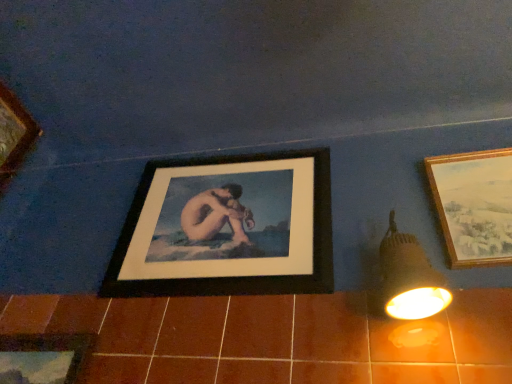
Question: Is wooden picture frame at lower left, which is the 1th picture frame in left-to-right order, oriented away from black matte picture frame at center, marked as the second picture frame in a right-to-left arrangement?

Choices:
 (A) yes
 (B) no

Answer: (B)

Question: From a real-world perspective, is wooden picture frame at lower left, which is the 1th picture frame in left-to-right order, located higher than black matte picture frame at center, marked as the second picture frame in a right-to-left arrangement?

Choices:
 (A) no
 (B) yes

Answer: (A)

Question: From the image's perspective, would you say wooden picture frame at lower left, the 3th picture frame from the right, is positioned over black matte picture frame at center, marked as the second picture frame in a right-to-left arrangement?

Choices:
 (A) yes
 (B) no

Answer: (B)

Question: Considering the relative positions of wooden picture frame at lower left, which is the 1th picture frame in left-to-right order, and black matte picture frame at center, the 2th picture frame viewed from the left, in the image provided, is wooden picture frame at lower left, which is the 1th picture frame in left-to-right order, to the left of black matte picture frame at center, the 2th picture frame viewed from the left, from the viewer's perspective?

Choices:
 (A) no
 (B) yes

Answer: (B)

Question: From a real-world perspective, is wooden picture frame at lower left, which is the 1th picture frame in left-to-right order, below black matte picture frame at center, marked as the second picture frame in a right-to-left arrangement?

Choices:
 (A) no
 (B) yes

Answer: (B)

Question: Is wooden picture frame at lower left, the 3th picture frame from the right, inside the boundaries of wooden framed landscape painting at right, which appears as the 3th picture frame when viewed from the left, or outside?

Choices:
 (A) inside
 (B) outside

Answer: (B)

Question: In terms of height, does wooden picture frame at lower left, the 3th picture frame from the right, look taller or shorter compared to wooden framed landscape painting at right, placed as the 1th picture frame when sorted from right to left?

Choices:
 (A) short
 (B) tall

Answer: (A)

Question: Looking at their shapes, would you say wooden picture frame at lower left, which is the 1th picture frame in left-to-right order, is wider or thinner than wooden framed landscape painting at right, placed as the 1th picture frame when sorted from right to left?

Choices:
 (A) wide
 (B) thin

Answer: (B)

Question: From a real-world perspective, is wooden picture frame at lower left, the 3th picture frame from the right, above or below wooden framed landscape painting at right, which appears as the 3th picture frame when viewed from the left?

Choices:
 (A) below
 (B) above

Answer: (A)

Question: From the image's perspective, is matte black light fixture at right located above or below wooden framed landscape painting at right, which appears as the 3th picture frame when viewed from the left?

Choices:
 (A) above
 (B) below

Answer: (B)

Question: From their relative heights in the image, would you say matte black light fixture at right is taller or shorter than wooden framed landscape painting at right, which appears as the 3th picture frame when viewed from the left?

Choices:
 (A) tall
 (B) short

Answer: (B)

Question: Considering the positions of point (403, 342) and point (497, 223), is point (403, 342) closer or farther from the camera than point (497, 223)?

Choices:
 (A) farther
 (B) closer

Answer: (B)

Question: Would you say matte black light fixture at right is to the left or to the right of wooden framed landscape painting at right, placed as the 1th picture frame when sorted from right to left, in the picture?

Choices:
 (A) left
 (B) right

Answer: (A)

Question: In terms of height, does matte black light fixture at right look taller or shorter compared to black matte picture frame at center, marked as the second picture frame in a right-to-left arrangement?

Choices:
 (A) short
 (B) tall

Answer: (A)

Question: From a real-world perspective, is matte black light fixture at right above or below black matte picture frame at center, marked as the second picture frame in a right-to-left arrangement?

Choices:
 (A) below
 (B) above

Answer: (A)